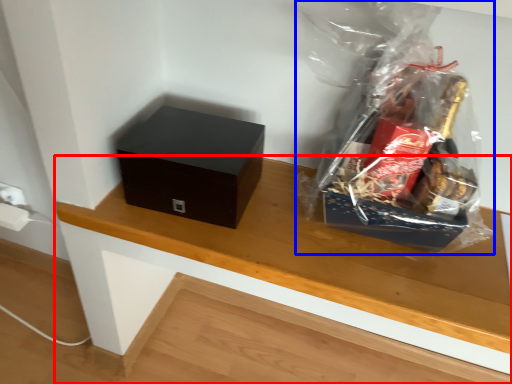
Question: Which of the following is the closest to the observer, table (highlighted by a red box) or plastic bag (highlighted by a blue box)?

Choices:
 (A) table
 (B) plastic bag

Answer: (B)